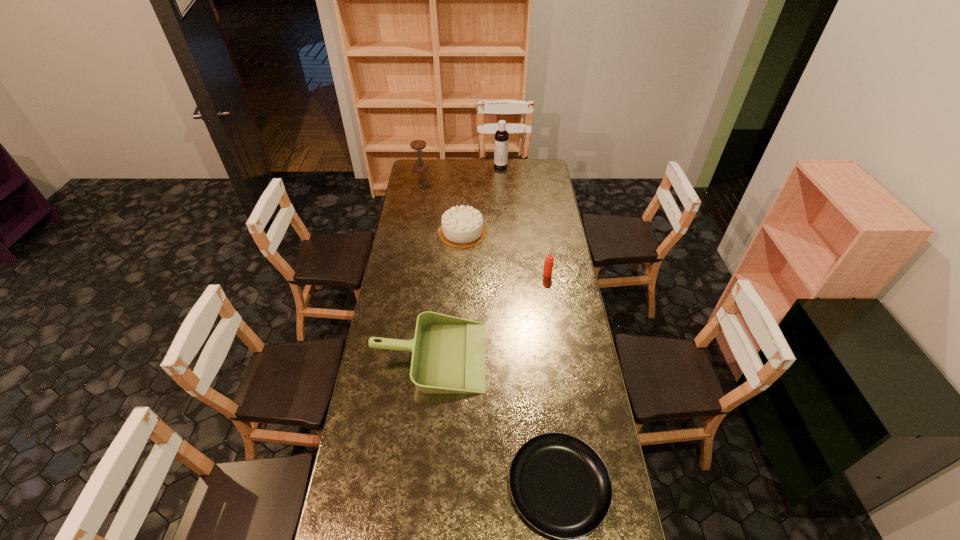
I want to click on vacant space located on the left of the fourth nearest object, so click(407, 232).

Identify the location of free space located 0.110m on the back of the Tabasco sauce. The height and width of the screenshot is (540, 960). (544, 256).

The height and width of the screenshot is (540, 960). Find the location of `free location located 0.360m on the scoop of the fifth tallest object`. free location located 0.360m on the scoop of the fifth tallest object is located at coordinates (573, 356).

Identify the location of dishwasher detergent at the far edge. (501, 135).

Identify the location of hourglass present at the far edge. The image size is (960, 540). (420, 166).

Locate an element on the screen. hourglass that is at the left edge is located at coordinates [420, 166].

You are a GUI agent. You are given a task and a screenshot of the screen. Output one action in this format:
    pyautogui.click(x=<x>, y=<y>)
    Task: Click on the dustpan positioned at the left edge
    The width and height of the screenshot is (960, 540).
    Given the screenshot: What is the action you would take?
    pyautogui.click(x=448, y=353)

Image resolution: width=960 pixels, height=540 pixels. Find the location of `object at the right edge`. object at the right edge is located at coordinates (549, 260).

Where is `object present at the far left corner`? object present at the far left corner is located at coordinates (420, 166).

The height and width of the screenshot is (540, 960). I want to click on free space at the far edge, so click(509, 162).